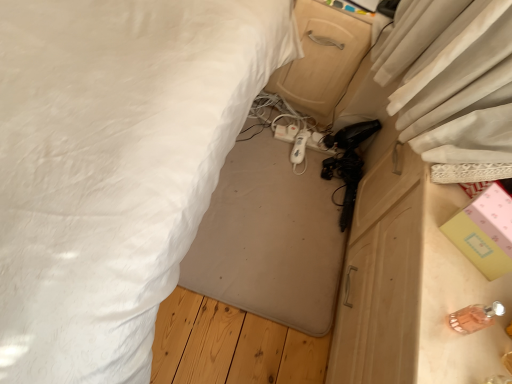
This screenshot has height=384, width=512. What are the coordinates of `vacant space behind translucent glass perfume bottle at lower right, the second equipment in the top-to-bottom sequence` in the screenshot? It's located at (453, 265).